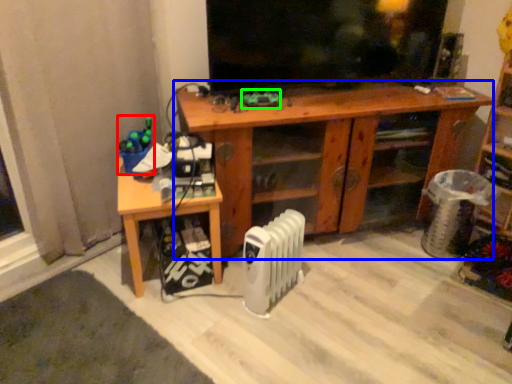
Question: Which is farther away from toy (highlighted by a red box)? desk (highlighted by a blue box) or toy (highlighted by a green box)?

Choices:
 (A) desk
 (B) toy

Answer: (A)